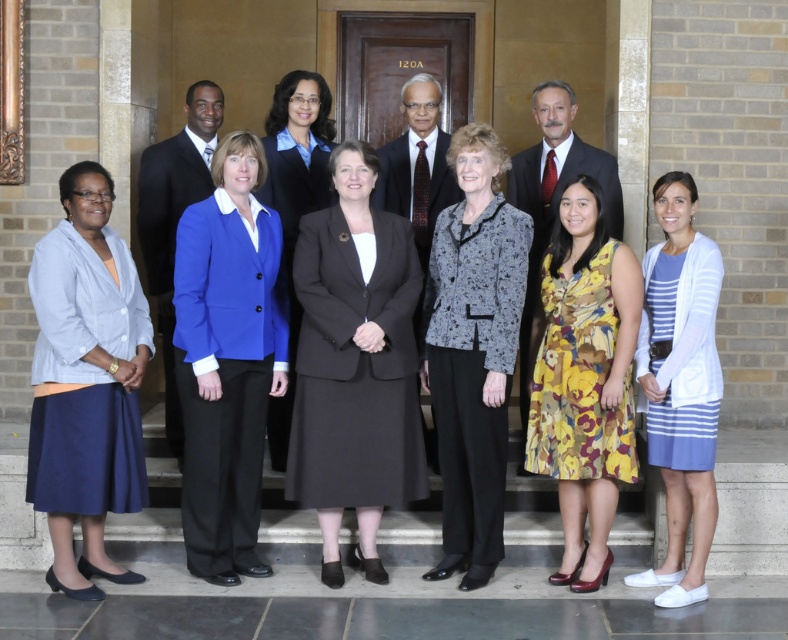
Where is the matte blue blazer at center located in the image?

The matte blue blazer at center is located at point (227, 358) in the image.

You are standing at the entrance of the building and see two points marked on the ground in front of you. The first point is labeled as point (374,301) and the second is point (710,468). If you were to walk from the entrance towards the second point, would you pass by the first point before reaching the second one?

Yes, because point (374,301) is behind point (710,468), so walking towards the second point would require passing the first point first.

You are a photographer at a professional event. You want to ensure that both the matte blue blazer at center and the shiny black suit at center are visible in your photo. Based on their positions, which one might naturally appear more prominent in the frame?

The matte blue blazer at center is in front of the shiny black suit at center, so it will naturally appear more prominent in the frame.